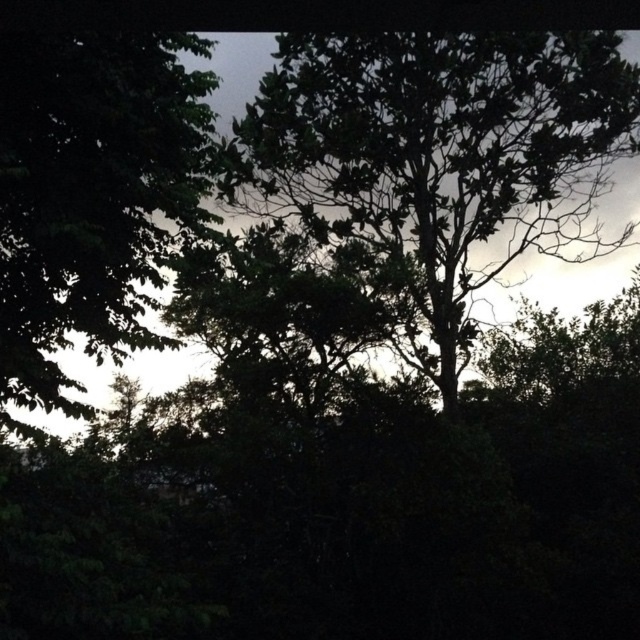
You are a bird looking for a nesting spot. You see a dark green leafy tree at center and a green leafy tree at left. Which tree would you choose if you prefer a smaller tree for nesting?

The dark green leafy tree at center has a smaller size compared to the green leafy tree at left, so you would choose the dark green leafy tree at center for nesting.

You are standing in a forest and see the dark green leafy tree at center and the green leafy tree at left. Which tree is closer to your left side?

The green leafy tree at left is closer to your left side because it is positioned to the left of the dark green leafy tree at center.